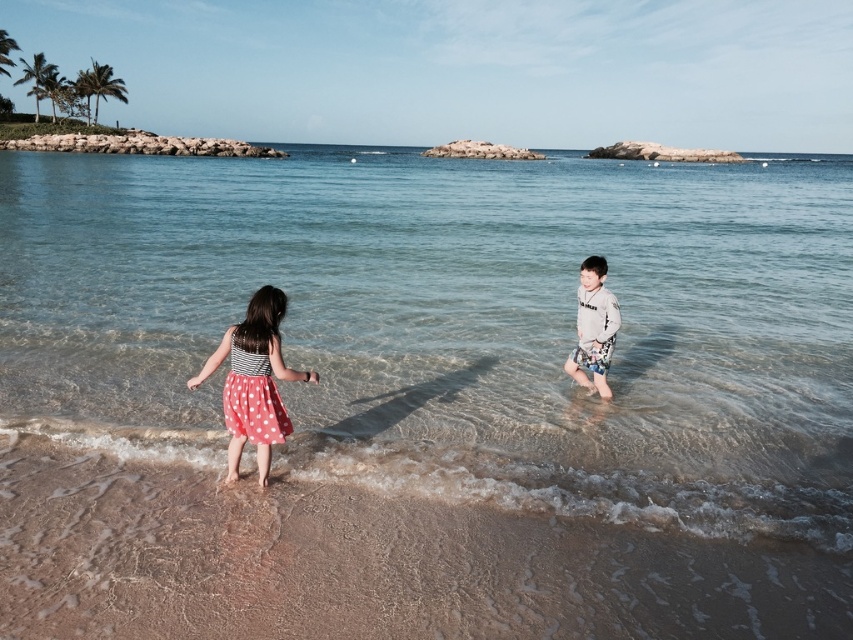
You are a photographer trying to capture the clear water at center and the polka dot fabric dress at lower left in the same frame. Since you want both subjects to be clearly visible, which one should you focus on first to ensure proper exposure? Explain your reasoning based on their sizes in the scene.

The clear water at center is larger in size than the polka dot fabric dress at lower left. To ensure proper exposure for both, focus on the larger subject, the clear water at center, as it occupies more of the frame and its exposure will have a greater impact on the overall image.

You are a photographer trying to capture a photo of both the polka dot fabric dress at lower left and the light gray cotton shirt at center. Since you want both subjects to appear equally sized in the photo, which child should you move closer to the camera?

The light gray cotton shirt at center is shorter than the polka dot fabric dress at lower left, so you should move closer to the light gray cotton shirt at center to make it appear larger in the photo.